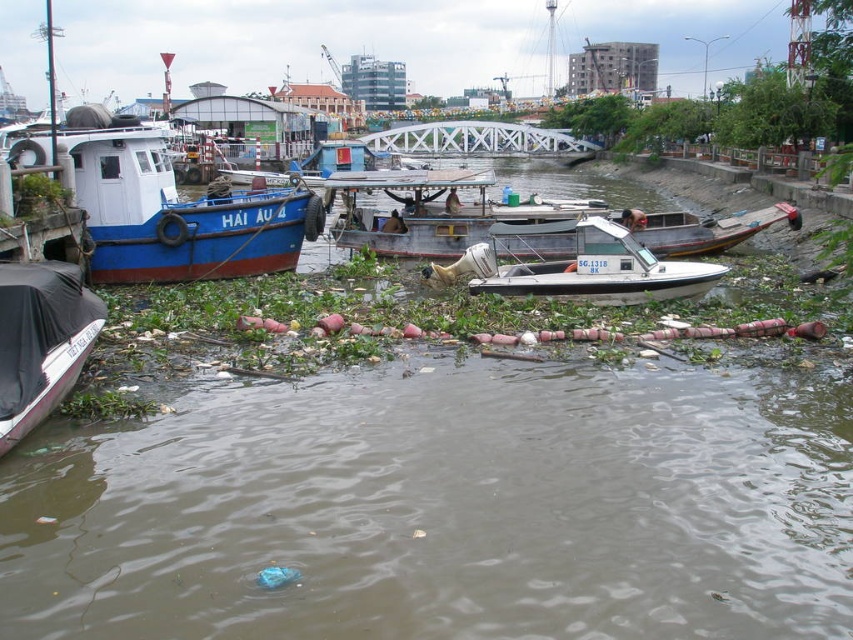
You are standing at the point labeled point (x=165, y=205). Which boat is directly in front of you?

The blue matte boat at left is located at point (x=165, y=205), so it is directly in front of you.

You are a boat inspector standing on the bank of the polluted waterway. You need to check the blue matte boat at left and the white plastic boat at center. Which boat should you inspect first if you want to start with the one closest to the water surface?

The blue matte boat at left is positioned under the white plastic boat at center, so it is closer to the water surface. Therefore, you should inspect the blue matte boat at left first.